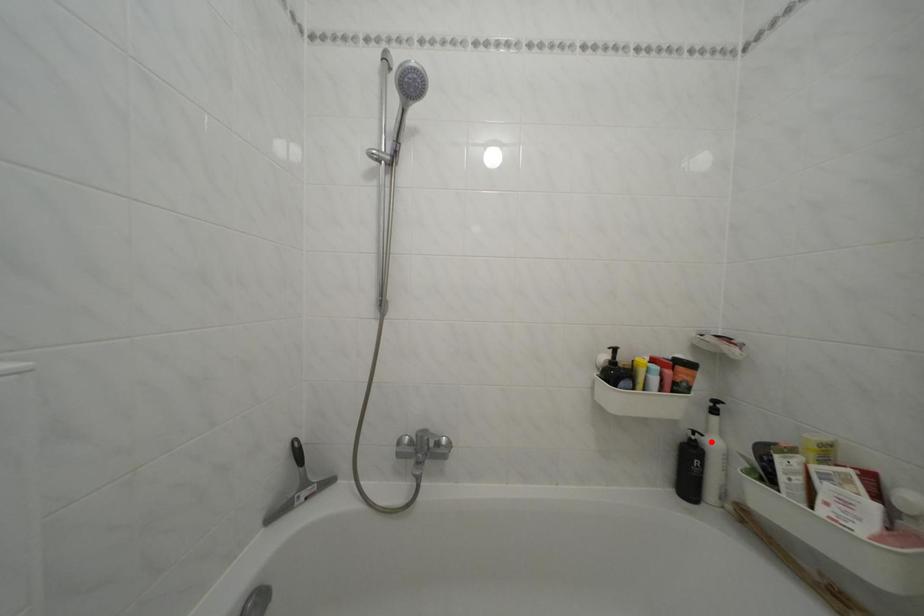
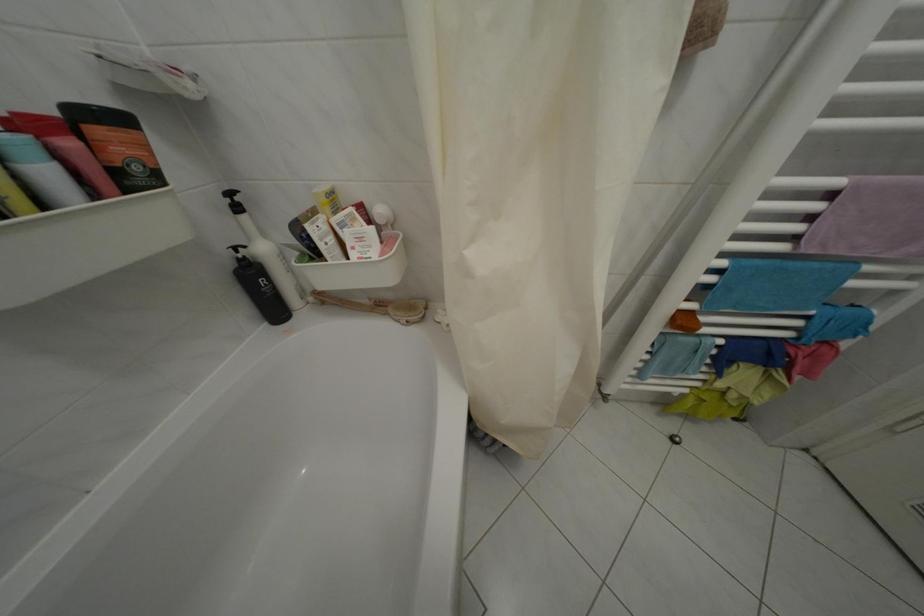
Question: A red point is marked in image1. In image2, is the corresponding 3D point closer to the camera or farther? Reply with the corresponding letter.

Choices:
 (A) The corresponding 3D point is closer.
 (B) The corresponding 3D point is farther.

Answer: (A)